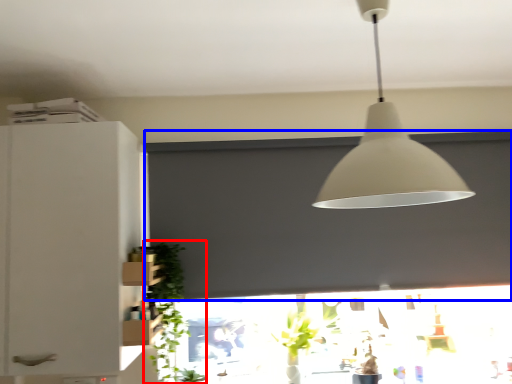
Question: Which object is closer to the camera taking this photo, plant (highlighted by a red box) or window screen (highlighted by a blue box)?

Choices:
 (A) plant
 (B) window screen

Answer: (A)